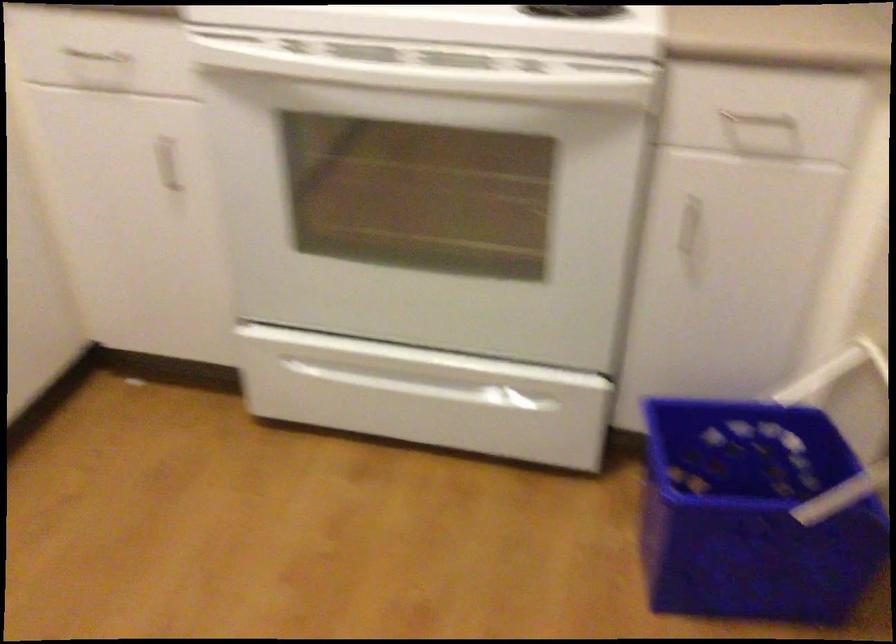
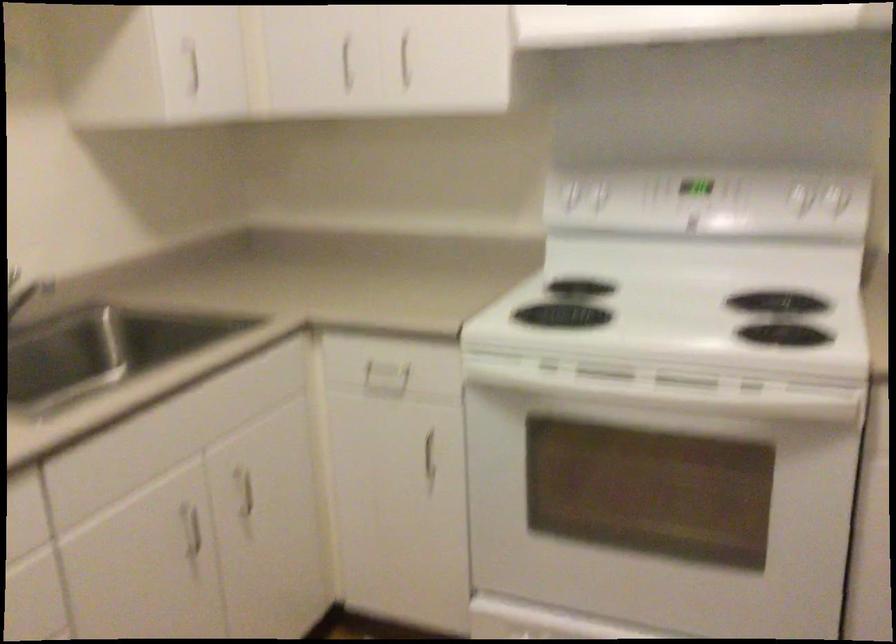
What movement of the cameraman would produce the second image?

The movement direction of the cameraman is left, backward.